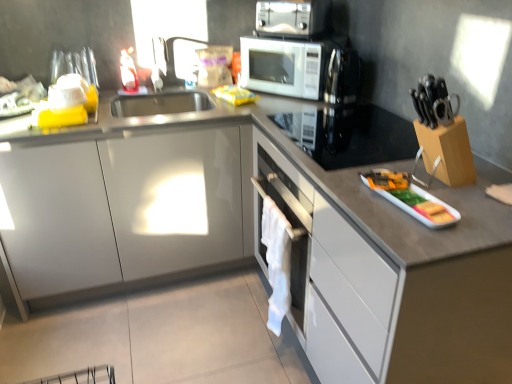
The image size is (512, 384). Find the location of `vacant area that lies to the right of white glossy tray at right, the second appliance in the top-to-bottom sequence`. vacant area that lies to the right of white glossy tray at right, the second appliance in the top-to-bottom sequence is located at coordinates (465, 198).